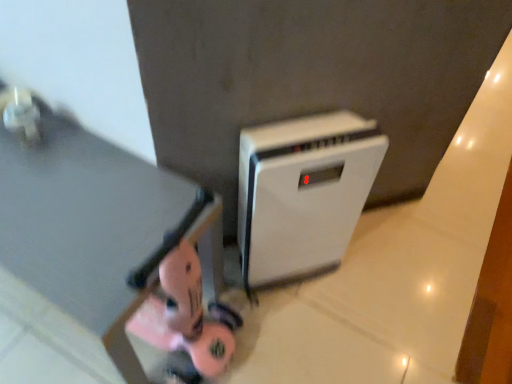
Question: Is the position of white plastic air purifier at center more distant than that of matte black table at lower left?

Choices:
 (A) no
 (B) yes

Answer: (B)

Question: Can you confirm if white plastic air purifier at center is bigger than matte black table at lower left?

Choices:
 (A) no
 (B) yes

Answer: (A)

Question: From the image's perspective, is white plastic air purifier at center located beneath matte black table at lower left?

Choices:
 (A) no
 (B) yes

Answer: (A)

Question: Can you confirm if white plastic air purifier at center is taller than matte black table at lower left?

Choices:
 (A) no
 (B) yes

Answer: (B)

Question: Is white plastic air purifier at center far from matte black table at lower left?

Choices:
 (A) no
 (B) yes

Answer: (A)

Question: Is white plastic air purifier at center thinner than matte black table at lower left?

Choices:
 (A) yes
 (B) no

Answer: (A)

Question: From the image's perspective, does matte black table at lower left appear higher than white plastic air purifier at center?

Choices:
 (A) no
 (B) yes

Answer: (A)

Question: From the image's perspective, is matte black table at lower left located beneath white plastic air purifier at center?

Choices:
 (A) no
 (B) yes

Answer: (B)

Question: Is white plastic air purifier at center a part of matte black table at lower left?

Choices:
 (A) yes
 (B) no

Answer: (B)

Question: Does matte black table at lower left appear on the left side of white plastic air purifier at center?

Choices:
 (A) yes
 (B) no

Answer: (A)

Question: Does matte black table at lower left have a lesser height compared to white plastic air purifier at center?

Choices:
 (A) yes
 (B) no

Answer: (A)

Question: Does matte black table at lower left come behind white plastic air purifier at center?

Choices:
 (A) no
 (B) yes

Answer: (A)

Question: Considering the positions of matte black table at lower left and white plastic air purifier at center in the image, is matte black table at lower left bigger or smaller than white plastic air purifier at center?

Choices:
 (A) small
 (B) big

Answer: (B)